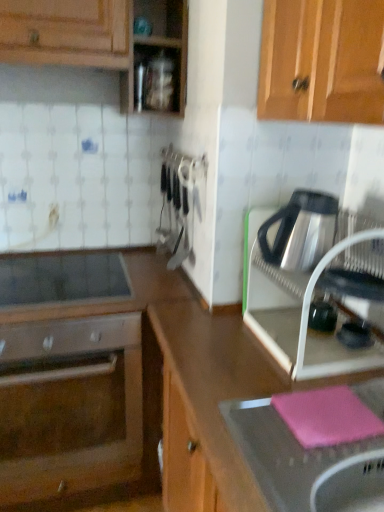
Question: In the image, is pink rubber mat at lower right positioned in front of or behind satin silver oven at lower left?

Choices:
 (A) behind
 (B) front

Answer: (B)

Question: In the image, is pink rubber mat at lower right on the left side or the right side of satin silver oven at lower left?

Choices:
 (A) right
 (B) left

Answer: (A)

Question: Based on their relative distances, which object is farther from the shiny metallic kettle at right, the second kitchen appliance positioned from the top?

Choices:
 (A) satin silver kettle at right, which ranks as the 2th kitchen appliance in bottom-to-top order
 (B) smooth glass cooktop at center-left
 (C) pink rubber mat at lower right
 (D) satin silver oven at lower left

Answer: (D)

Question: Which object is the closest to the smooth glass cooktop at center-left?

Choices:
 (A) satin silver oven at lower left
 (B) satin silver kettle at right, acting as the 1th kitchen appliance starting from the top
 (C) pink rubber mat at lower right
 (D) shiny metallic kettle at right, which ranks as the first kitchen appliance in bottom-to-top order

Answer: (D)